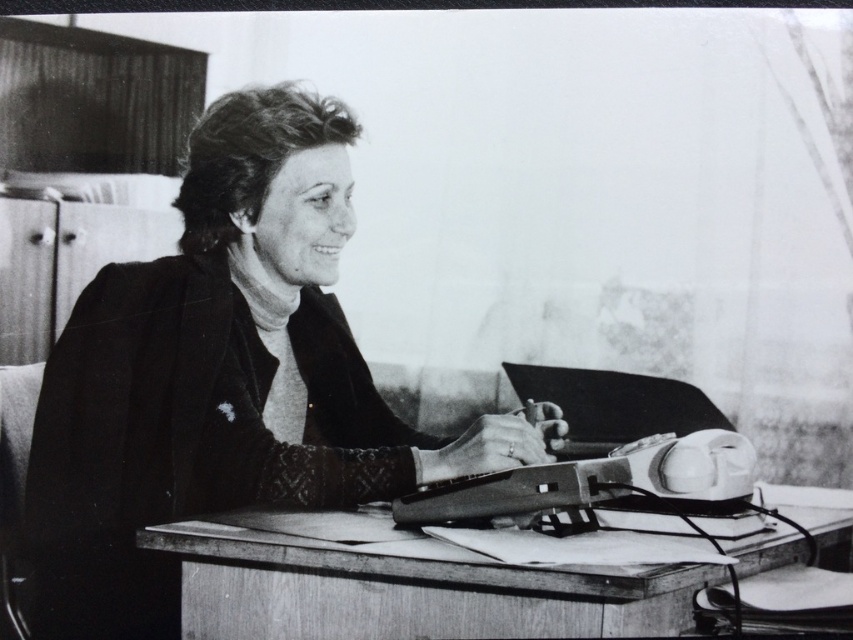
You are a delivery person who needs to place a small package between the smooth black sweater at center and the shiny black laptop at center. Can you fit it there?

The smooth black sweater at center and the shiny black laptop at center are 13.18 inches apart. Since the package is small, it should fit between them.

You are organizing a meeting and need to place a name tag on the wooden table at center and the shiny black laptop at center. According to the image, which object should you place the name tag to the right of?

You should place the name tag to the right of the shiny black laptop at center because the wooden table at center is located to the right of the shiny black laptop at center.

You are a delivery person who needs to place a small package between the smooth black sweater at center and the typewriter on the desk. The package is 1.2 meters long. Can you fit it between them?

The smooth black sweater at center and the typewriter on the desk are 1.19 meters apart. Since the package is 1.2 meters long, it cannot fit between them as the distance is slightly shorter than the package length.